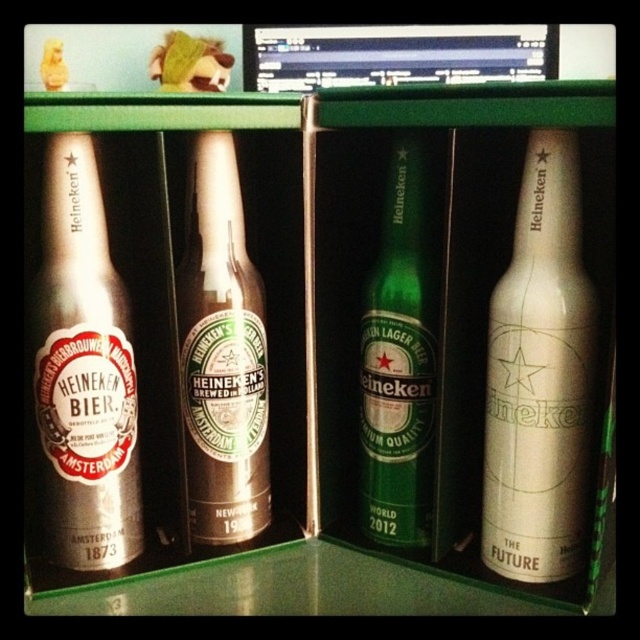
Question: Does green glass bottle at center have a smaller size compared to black glossy monitor at upper center?

Choices:
 (A) yes
 (B) no

Answer: (B)

Question: Estimate the real-world distances between objects in this image. Which object is closer to the metallic silver bottle at right?

Choices:
 (A) black glossy monitor at upper center
 (B) brushed metal heineken bottle at left
 (C) brown glass bottle at center

Answer: (C)

Question: Among these objects, which one is nearest to the camera?

Choices:
 (A) black glossy monitor at upper center
 (B) brushed metal heineken bottle at left
 (C) green glass bottle at center

Answer: (B)

Question: Can you confirm if metallic silver bottle at right is positioned below brushed metal heineken bottle at left?

Choices:
 (A) no
 (B) yes

Answer: (B)

Question: Can you confirm if brushed metal heineken bottle at left is smaller than green glass bottle at center?

Choices:
 (A) yes
 (B) no

Answer: (B)

Question: Which of the following is the closest to the observer?

Choices:
 (A) brushed metal heineken bottle at left
 (B) black glossy monitor at upper center

Answer: (A)